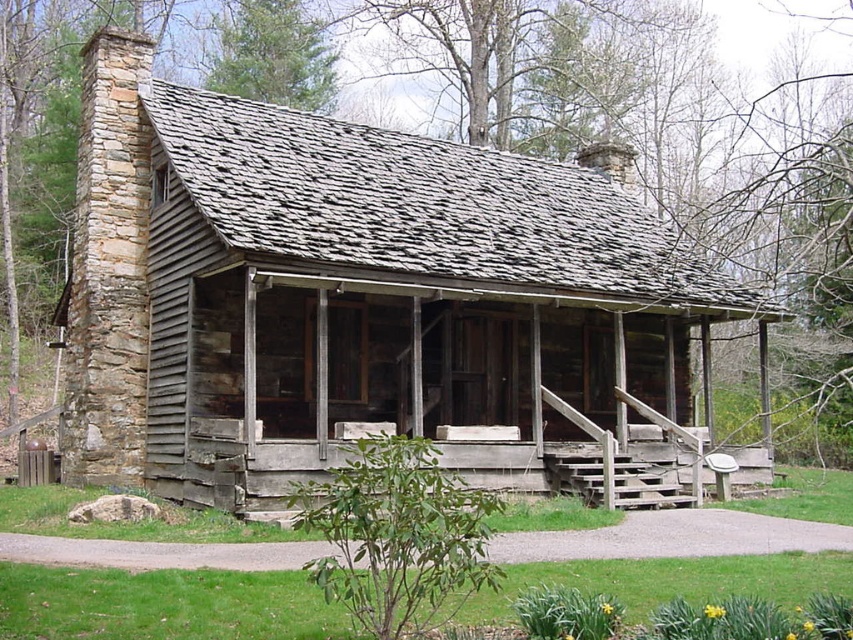
Consider the image. You are standing at the point labeled as point (349, 294). Which object are you closest to?

You are closest to the rustic wood cabin at center, as the point (349, 294) represents its location.

You are standing in front of the rustic log cabin and want to place two decorative items at the specified coordinates. The first item is to be placed at point [323,472] and the second at point [512,484]. Which of these points is closer to the entrance of the cabin?

Point [323,472] is in front of point [512,484], so the first point is closer to the entrance of the cabin.

You are a delivery person carrying a package that requires a 2.5 meter clearance to pass through the cabin entrance. Can you safely navigate between the rustic wood cabin at center and the weathered wood porch at center with your package?

The rustic wood cabin at center and weathered wood porch at center are 3.03 meters apart from each other, so yes, you can safely navigate between them with your package as the distance is greater than the required 2.5 meter clearance.